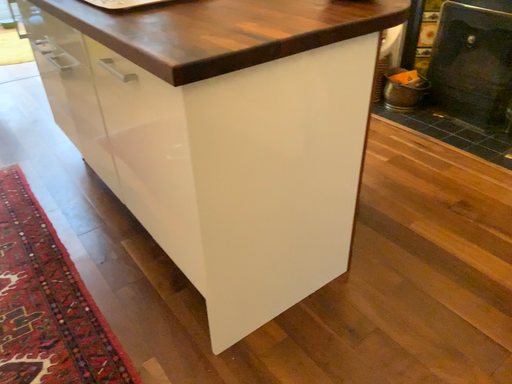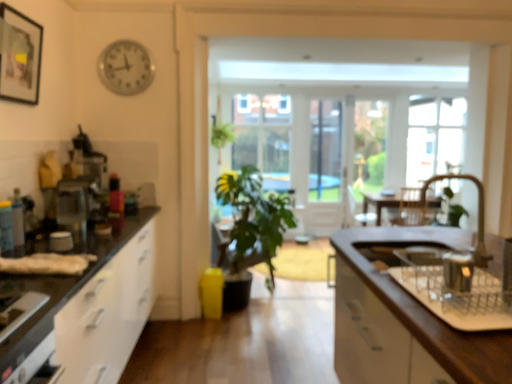
Question: How did the camera likely rotate when shooting the video?

Choices:
 (A) rotated upward
 (B) rotated downward

Answer: (A)